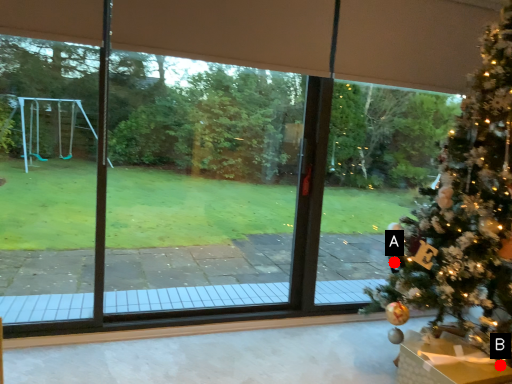
Question: Two points are circled on the image, labeled by A and B beside each circle. Which point is farther from the camera taking this photo?

Choices:
 (A) A is further
 (B) B is further

Answer: (A)